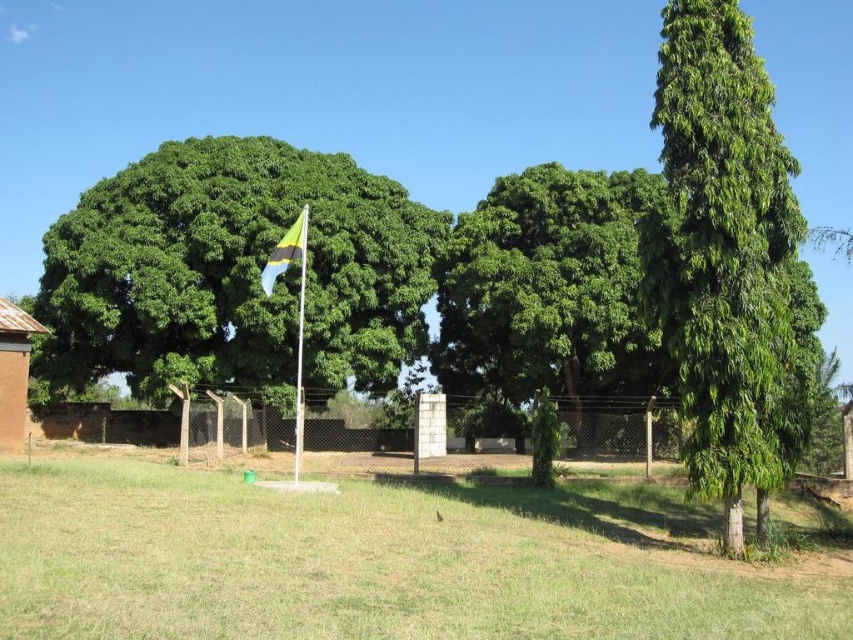
Does point (41, 532) lie behind point (19, 428)?

No, (41, 532) is closer to viewer.

Who is more distant from viewer, [61,499] or [38,326]?

Point [38,326]

What are the coordinates of `green grass at center` in the screenshot? It's located at (376, 563).

Which is more to the right, white plastic flag pole at center or blue-green fabric flag at center-left?

From the viewer's perspective, blue-green fabric flag at center-left appears more on the right side.

Who is more distant from viewer, [294,474] or [288,236]?

Point [294,474]

Image resolution: width=853 pixels, height=640 pixels. In order to click on white plastic flag pole at center in this screenshot , I will do `click(299, 336)`.

How much distance is there between green grass at center and blue-green fabric flag at center-left?

The distance of green grass at center from blue-green fabric flag at center-left is 7.75 meters.

This screenshot has width=853, height=640. In order to click on green grass at center in this screenshot , I will do `click(376, 563)`.